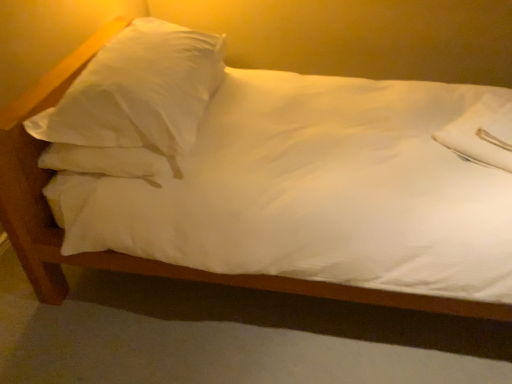
Question: Does white soft pillow at upper right, which is the second pillow from left to right, have a smaller size compared to white satin pillow at upper left, acting as the first pillow starting from the left?

Choices:
 (A) yes
 (B) no

Answer: (A)

Question: Considering the relative sizes of white soft pillow at upper right, which is the 1th pillow from right to left, and white satin pillow at upper left, the 2th pillow from the right, in the image provided, is white soft pillow at upper right, which is the 1th pillow from right to left, bigger than white satin pillow at upper left, the 2th pillow from the right,?

Choices:
 (A) no
 (B) yes

Answer: (A)

Question: Does white soft pillow at upper right, which is the second pillow from left to right, have a greater height compared to white satin pillow at upper left, acting as the first pillow starting from the left?

Choices:
 (A) yes
 (B) no

Answer: (B)

Question: Could you tell me if white soft pillow at upper right, which is the second pillow from left to right, is turned towards white satin pillow at upper left, acting as the first pillow starting from the left?

Choices:
 (A) no
 (B) yes

Answer: (A)

Question: From a real-world perspective, is white soft pillow at upper right, which is the 1th pillow from right to left, over white satin pillow at upper left, acting as the first pillow starting from the left?

Choices:
 (A) no
 (B) yes

Answer: (A)

Question: Does white soft pillow at upper right, which is the 1th pillow from right to left, have a greater width compared to white satin pillow at upper left, the 2th pillow from the right?

Choices:
 (A) no
 (B) yes

Answer: (A)

Question: Is white satin pillow at upper left, the 2th pillow from the right, bigger than white soft pillow at upper right, which is the second pillow from left to right?

Choices:
 (A) yes
 (B) no

Answer: (A)

Question: Does white satin pillow at upper left, acting as the first pillow starting from the left, appear on the right side of white soft pillow at upper right, which is the 1th pillow from right to left?

Choices:
 (A) no
 (B) yes

Answer: (A)

Question: Would you say white satin pillow at upper left, the 2th pillow from the right, contains white soft pillow at upper right, which is the 1th pillow from right to left?

Choices:
 (A) yes
 (B) no

Answer: (B)

Question: Is white satin pillow at upper left, the 2th pillow from the right, oriented towards white soft pillow at upper right, which is the second pillow from left to right?

Choices:
 (A) no
 (B) yes

Answer: (A)

Question: Does white satin pillow at upper left, the 2th pillow from the right, have a lesser height compared to white soft pillow at upper right, which is the 1th pillow from right to left?

Choices:
 (A) yes
 (B) no

Answer: (B)

Question: Is white satin pillow at upper left, the 2th pillow from the right, behind white soft pillow at upper right, which is the 1th pillow from right to left?

Choices:
 (A) yes
 (B) no

Answer: (B)

Question: Considering the positions of white soft pillow at upper right, which is the 1th pillow from right to left, and white satin pillow at upper left, acting as the first pillow starting from the left, in the image, is white soft pillow at upper right, which is the 1th pillow from right to left, bigger or smaller than white satin pillow at upper left, acting as the first pillow starting from the left,?

Choices:
 (A) small
 (B) big

Answer: (A)